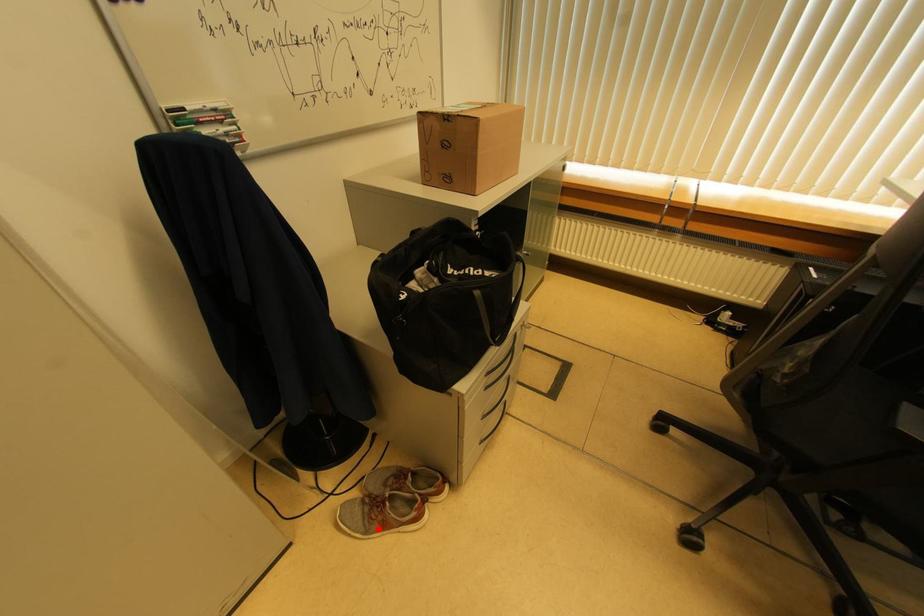
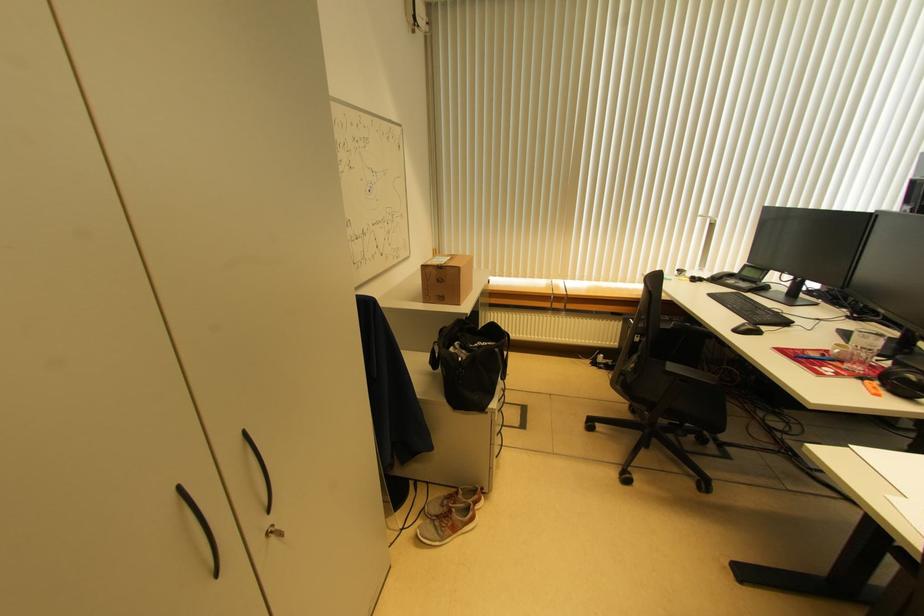
Where in the second image is the point corresponding to the highlighted location from the first image?

(450, 535)